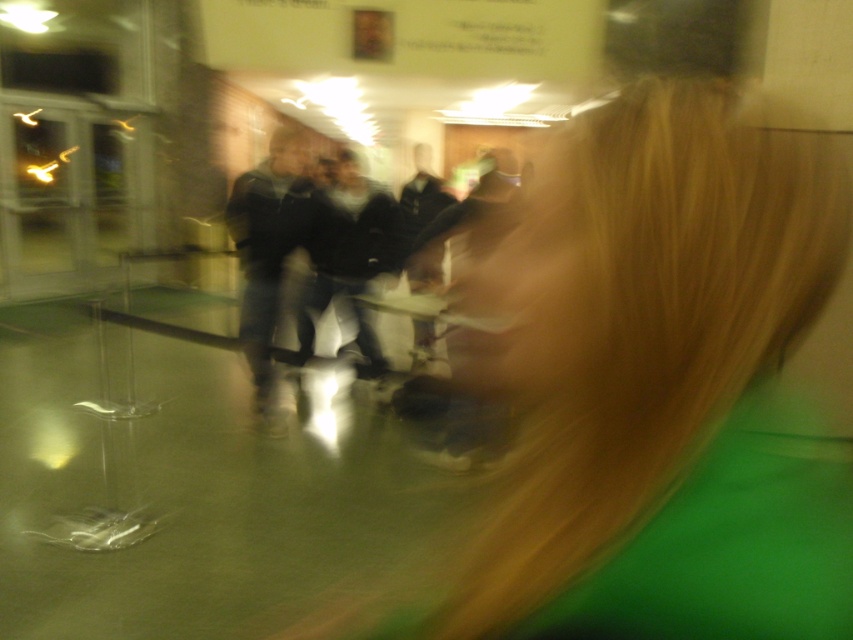
You are a photographer trying to capture a clear shot of the scene. The point at coordinates [660,387] is crucial for focusing. What object at this location needs to be in sharp focus to ensure the photo isn???t blurry?

The point at coordinates [660,387] indicates blonde hair at center, so focusing on the blonde hair at center will ensure the photo isn???t blurry.

You are a security camera in a lobby. You need to describe the position of the blonde hair at center and the dark gray jacket at center relative to each other. Which one is on the right side?

The blonde hair at center is to the right of dark gray jacket at center.